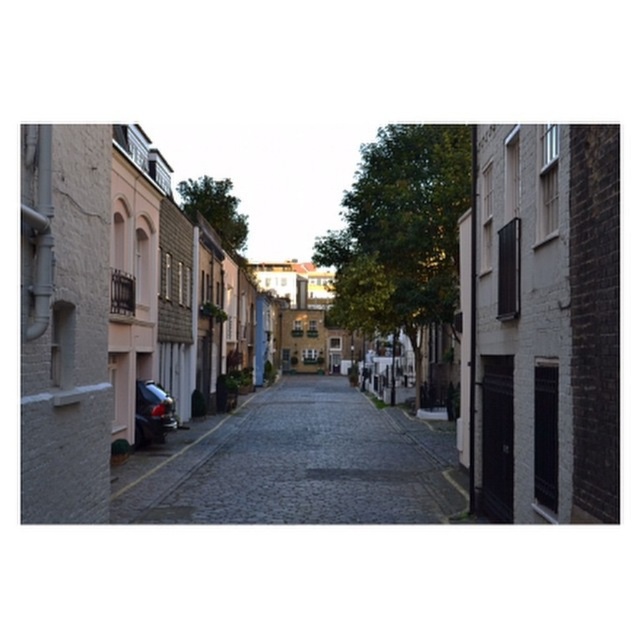
Question: Which of the following is the closest to the observer?

Choices:
 (A) dark gray cobblestone alley at center
 (B) shiny metallic car at lower left

Answer: (A)

Question: Which point appears closest to the camera in this image?

Choices:
 (A) (388, 477)
 (B) (134, 426)

Answer: (A)

Question: Is dark gray cobblestone alley at center to the left of shiny metallic car at lower left from the viewer's perspective?

Choices:
 (A) yes
 (B) no

Answer: (B)

Question: Can you confirm if dark gray cobblestone alley at center is thinner than shiny metallic car at lower left?

Choices:
 (A) yes
 (B) no

Answer: (B)

Question: Where is dark gray cobblestone alley at center located in relation to shiny metallic car at lower left in the image?

Choices:
 (A) left
 (B) right

Answer: (B)